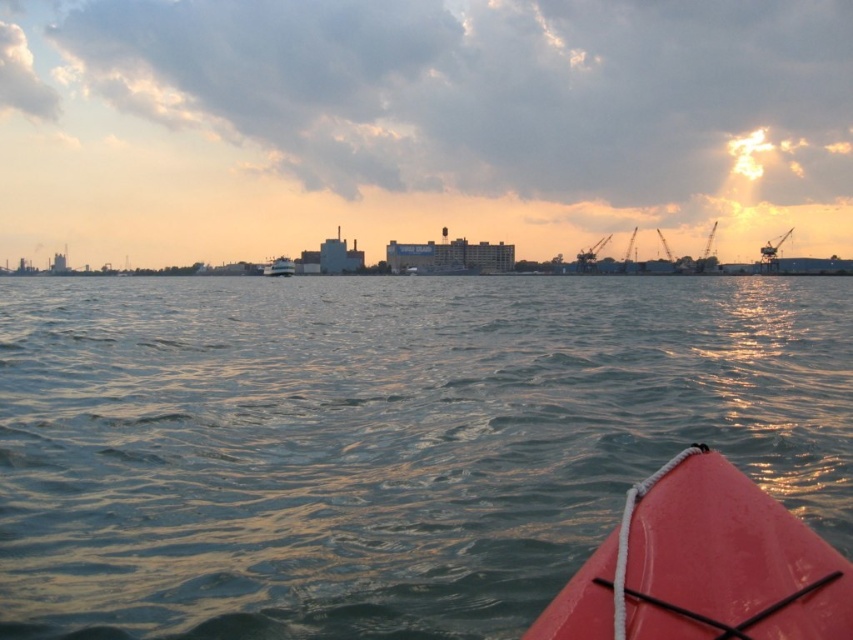
Based on the scene description, what does the point at coordinates (381, 442) represent?

The point at coordinates (381, 442) represents greenish water at center.

From the picture: You are planning to take a photo of the waterfront scene. You want to ensure both the greenish water at center and the rubberized pink kayak at lower right are clearly visible. Given their sizes, which object should you focus on to capture both effectively?

The greenish water at center has a larger size compared to the rubberized pink kayak at lower right. To capture both effectively, focus on the greenish water at center as it is larger and will remain in focus while the smaller kayak may still be visible in the frame.

You are in a kayak at sunset and notice a point marked at coordinates (703, 566). What object is located at that point?

The point at (703, 566) corresponds to the rubberized pink kayak at lower right.